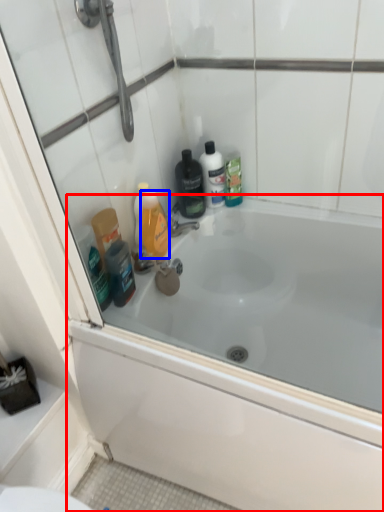
Question: Among these objects, which one is nearest to the camera, bathtub (highlighted by a red box) or mouthwash (highlighted by a blue box)?

Choices:
 (A) bathtub
 (B) mouthwash

Answer: (A)